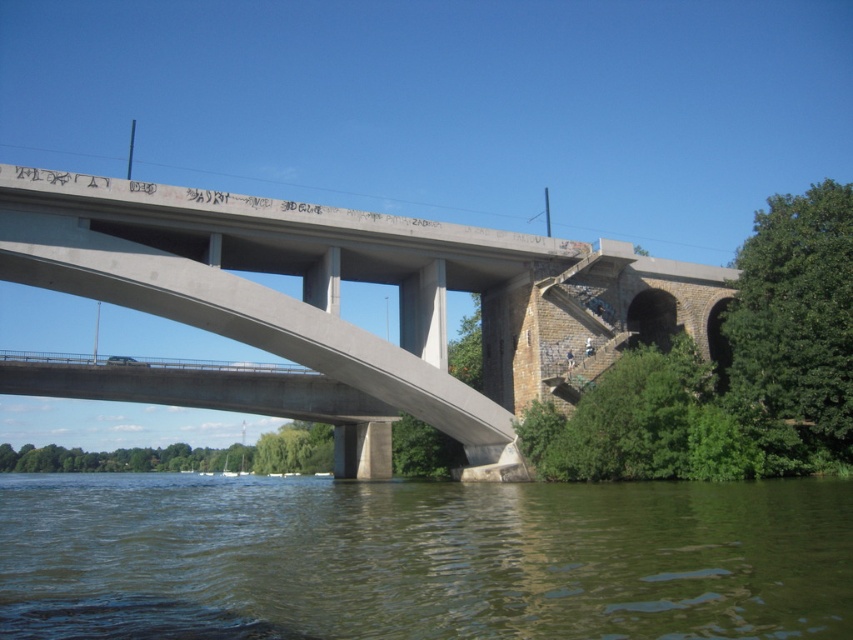
Does greenish water at lower center appear on the right side of concrete bridge at center?

Yes, greenish water at lower center is to the right of concrete bridge at center.

Looking at this image, between greenish water at lower center and concrete bridge at center, which one is positioned lower?

greenish water at lower center

Between point (369, 500) and point (723, 300), which one is positioned in front?

Point (369, 500) is in front.

This screenshot has height=640, width=853. Find the location of `greenish water at lower center`. greenish water at lower center is located at coordinates (421, 557).